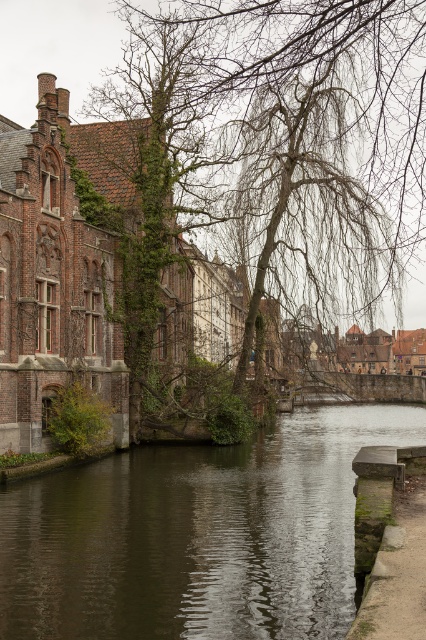
Question: Does green ivy-covered tree at left appear over green mossy stone at lower right?

Choices:
 (A) yes
 (B) no

Answer: (A)

Question: Is green ivy-covered tree at left positioned at the back of dark brown water at center?

Choices:
 (A) no
 (B) yes

Answer: (B)

Question: Is green ivy-covered tree at left below green mossy stone at lower right?

Choices:
 (A) no
 (B) yes

Answer: (A)

Question: Which point is farther from the camera taking this photo?

Choices:
 (A) (183, 500)
 (B) (423, 221)

Answer: (B)

Question: Which of the following is the farthest from the observer?

Choices:
 (A) (218, 237)
 (B) (400, 516)
 (C) (189, 582)

Answer: (A)

Question: Which point is farther to the camera?

Choices:
 (A) dark brown water at center
 (B) green ivy-covered tree at left

Answer: (B)